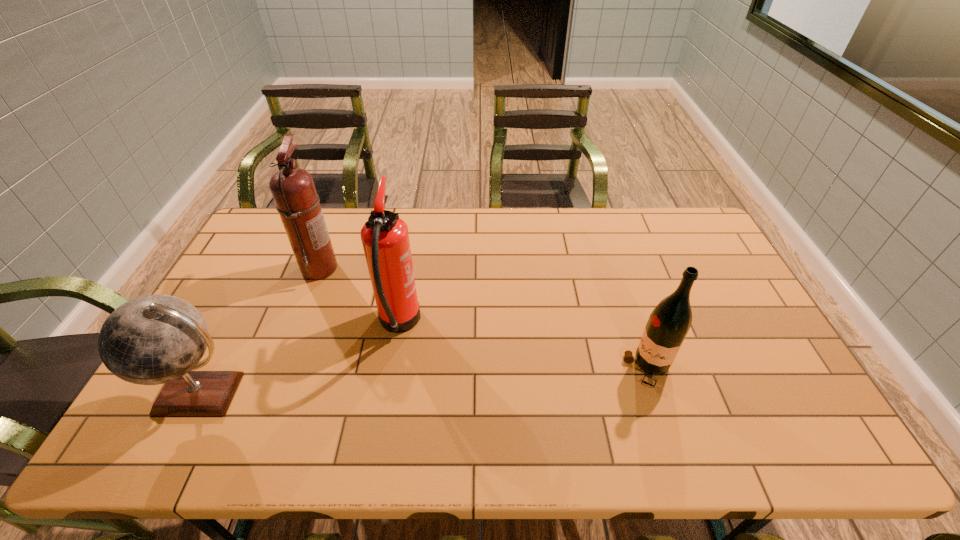
At what (x,y) coordinates should I click in order to perform the action: click on vacant area in the image that satisfies the following two spatial constraints: 1. on the front-facing side of the left fire extinguisher; 2. at the equator of the leftmost object. Please return your answer as a coordinate pair (x, y). Looking at the image, I should click on click(x=272, y=393).

Locate an element on the screen. Image resolution: width=960 pixels, height=540 pixels. free space that satisfies the following two spatial constraints: 1. at the nozzle of the right fire extinguisher; 2. on the right side of the rightmost object is located at coordinates (392, 369).

Find the location of `free location that satisfies the following two spatial constraints: 1. on the front-facing side of the wine bottle; 2. on the right side of the farther fire extinguisher`. free location that satisfies the following two spatial constraints: 1. on the front-facing side of the wine bottle; 2. on the right side of the farther fire extinguisher is located at coordinates (281, 369).

Where is `vacant point that satisfies the following two spatial constraints: 1. on the front-facing side of the farther fire extinguisher; 2. at the equator of the globe`? This screenshot has height=540, width=960. vacant point that satisfies the following two spatial constraints: 1. on the front-facing side of the farther fire extinguisher; 2. at the equator of the globe is located at coordinates (272, 393).

You are a GUI agent. You are given a task and a screenshot of the screen. Output one action in this format:
    pyautogui.click(x=<x>, y=<y>)
    Task: Click on the blank space that satisfies the following two spatial constraints: 1. at the nozzle of the nearer fire extinguisher; 2. on the left side of the rightmost object
    
    Given the screenshot: What is the action you would take?
    pyautogui.click(x=392, y=369)

Where is `free location that satisfies the following two spatial constraints: 1. on the front-facing side of the third object from right to left; 2. at the equator of the leftmost object`? The width and height of the screenshot is (960, 540). free location that satisfies the following two spatial constraints: 1. on the front-facing side of the third object from right to left; 2. at the equator of the leftmost object is located at coordinates (272, 393).

At what (x,y) coordinates should I click in order to perform the action: click on free location that satisfies the following two spatial constraints: 1. at the nozzle of the second object from right to left; 2. on the left side of the wine bottle. Please return your answer as a coordinate pair (x, y). This screenshot has width=960, height=540. Looking at the image, I should click on (392, 369).

Image resolution: width=960 pixels, height=540 pixels. I want to click on free spot that satisfies the following two spatial constraints: 1. at the nozzle of the third object from left to right; 2. at the equator of the leftmost object, so click(387, 393).

Find the location of a particular element. This screenshot has width=960, height=540. vacant area in the image that satisfies the following two spatial constraints: 1. at the nozzle of the right fire extinguisher; 2. on the back side of the wine bottle is located at coordinates (392, 369).

Where is `free point that satisfies the following two spatial constraints: 1. at the nozzle of the third object from left to right; 2. on the left side of the rightmost object`? Image resolution: width=960 pixels, height=540 pixels. free point that satisfies the following two spatial constraints: 1. at the nozzle of the third object from left to right; 2. on the left side of the rightmost object is located at coordinates (392, 369).